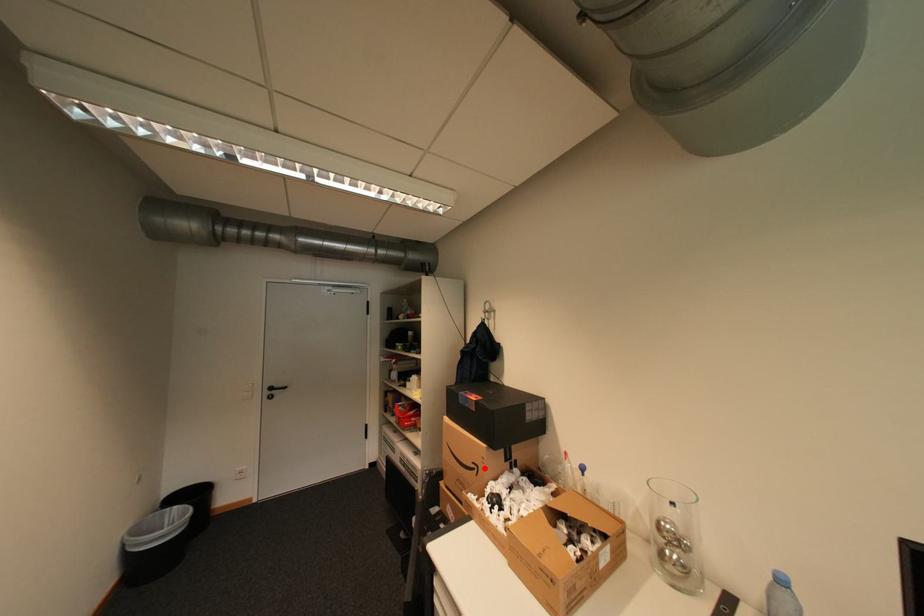
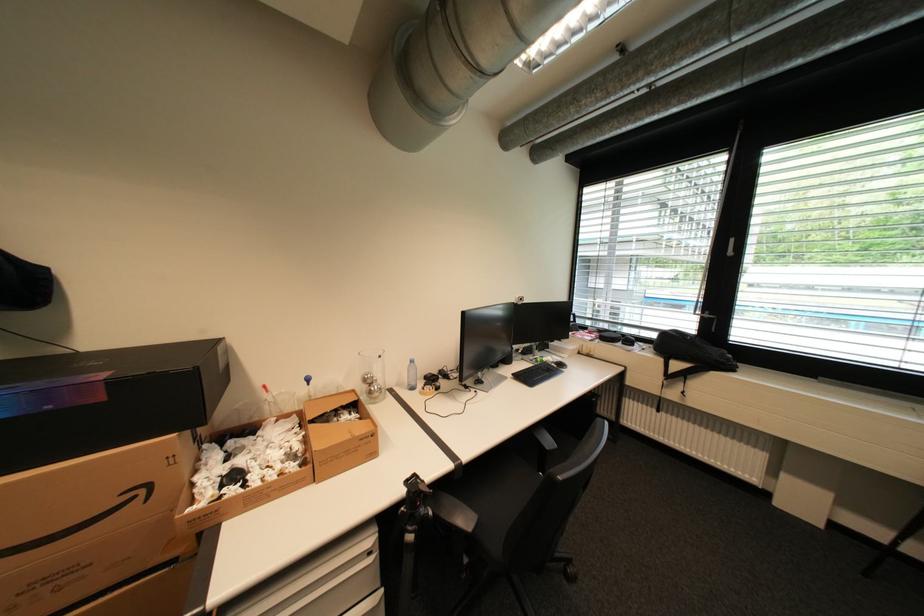
Question: I am providing you with two images of the same scene from different viewpoints. A red point is shown in image1. For the corresponding object point in image2, is it positioned nearer or farther from the camera?

Choices:
 (A) Nearer
 (B) Farther

Answer: (A)